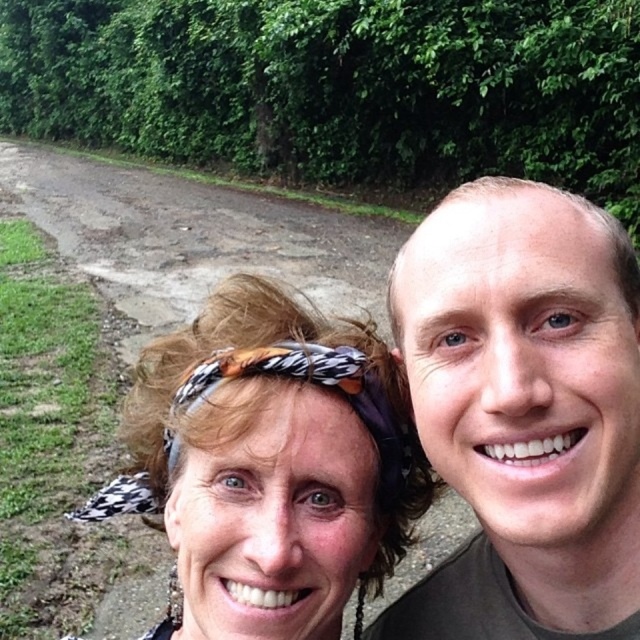
Does smooth skin face at right have a larger size compared to matte black headband at center?

Actually, smooth skin face at right might be smaller than matte black headband at center.

In the scene shown: Does smooth skin face at right come behind matte black headband at center?

No, it is in front of matte black headband at center.

What do you see at coordinates (524, 412) in the screenshot? I see `smooth skin face at right` at bounding box center [524, 412].

You are a GUI agent. You are given a task and a screenshot of the screen. Output one action in this format:
    pyautogui.click(x=<x>, y=<y>)
    Task: Click on the smooth skin face at right
    The height and width of the screenshot is (640, 640).
    Given the screenshot: What is the action you would take?
    pyautogui.click(x=524, y=412)

Looking at this image, is smooth skin face at right to the left of printed fabric headscarf at center from the viewer's perspective?

In fact, smooth skin face at right is to the right of printed fabric headscarf at center.

Where is `smooth skin face at right`? This screenshot has width=640, height=640. smooth skin face at right is located at coordinates (524, 412).

Who is more distant from viewer, (493,246) or (202,371)?

Positioned behind is point (202,371).

The height and width of the screenshot is (640, 640). Identify the location of smooth skin face at right. (524, 412).

Is point (189, 340) farther from viewer compared to point (326, 355)?

Yes, it is behind point (326, 355).

The image size is (640, 640). I want to click on matte black headband at center, so click(x=273, y=461).

Between point (356, 412) and point (358, 388), which one is positioned behind?

The point (358, 388) is more distant.

Locate an element on the screen. matte black headband at center is located at coordinates click(273, 461).